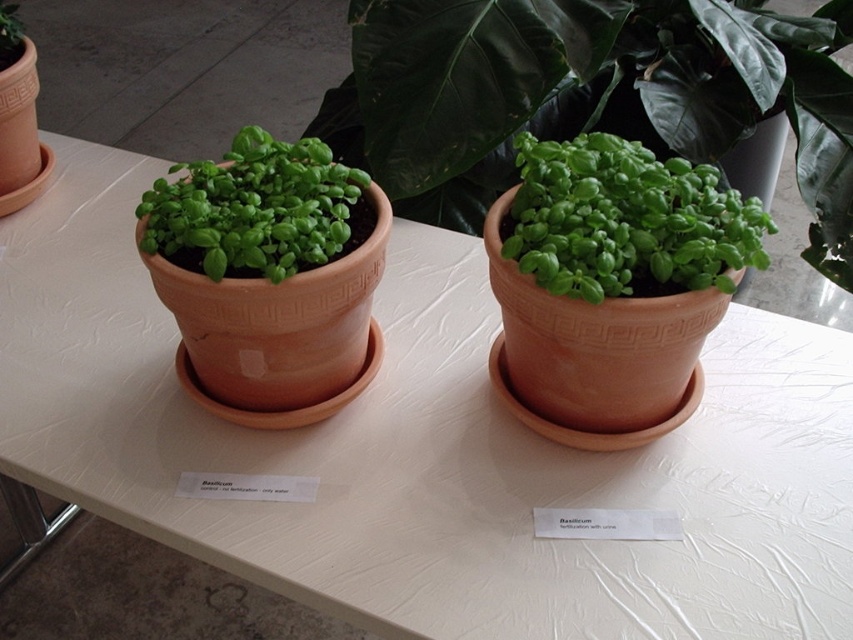
You are arranging plants on a table. You have a green matte pot at center and a green matte basil at left. Based on their positions, which one is higher up?

The green matte pot at center is above the green matte basil at left, so it is higher up.

You are a gardener who wants to transplant both green matte basil at center and green matte basil at left into new pots. Which of the two requires a larger pot due to its size?

The green matte basil at center requires a larger pot because its width is larger than the green matte basil at left.

You are standing 5 feet away from the table where the green matte pot at center is placed. Can you reach the pot without moving closer?

The green matte pot at center is 3.65 feet away from the viewer. Since you are standing 5 feet away from the table, you are farther than the pot, so you cannot reach it without moving closer.